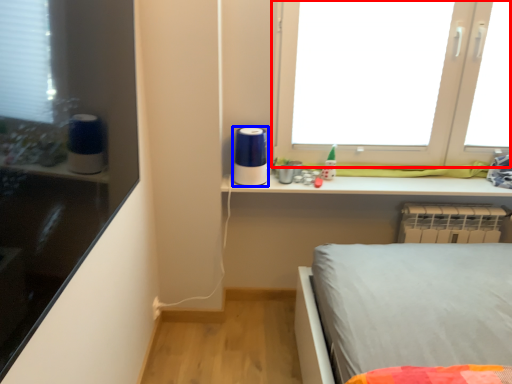
Question: Which object is further to the camera taking this photo, window (highlighted by a red box) or appliance (highlighted by a blue box)?

Choices:
 (A) window
 (B) appliance

Answer: (B)